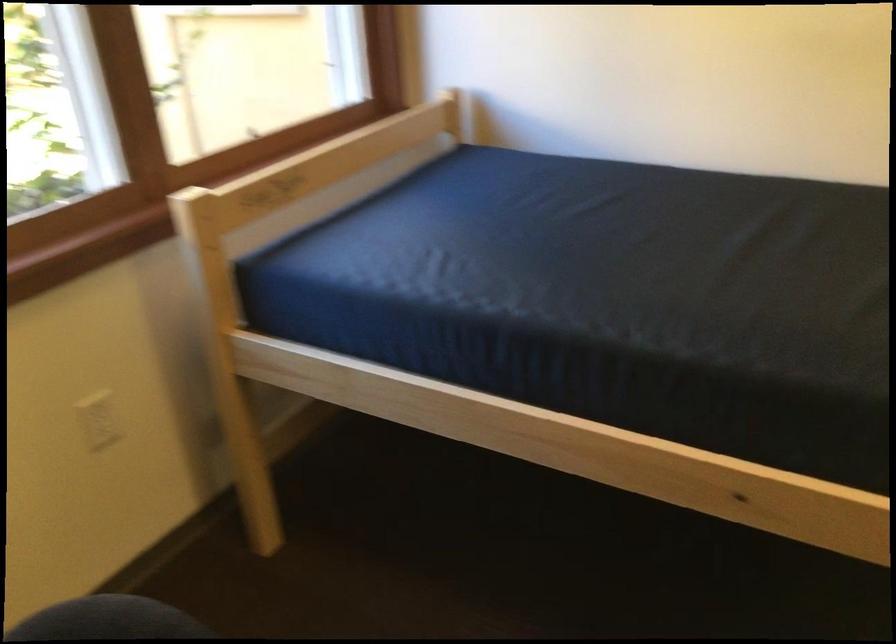
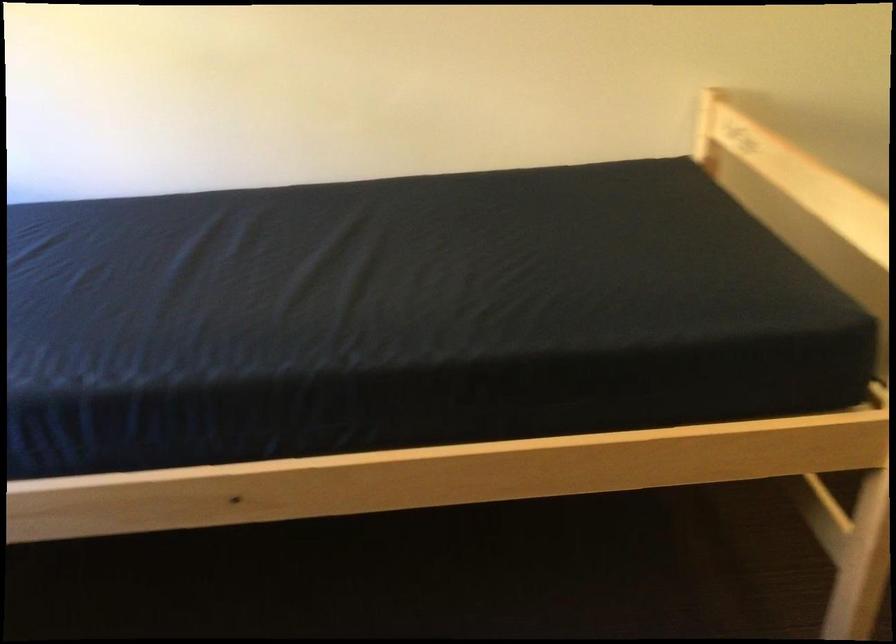
Question: The camera is either moving clockwise (left) or counter-clockwise (right) around the object. The first image is from the beginning of the video and the second image is from the end. Is the camera moving left or right when shooting the video?

Choices:
 (A) Left
 (B) Right

Answer: (A)